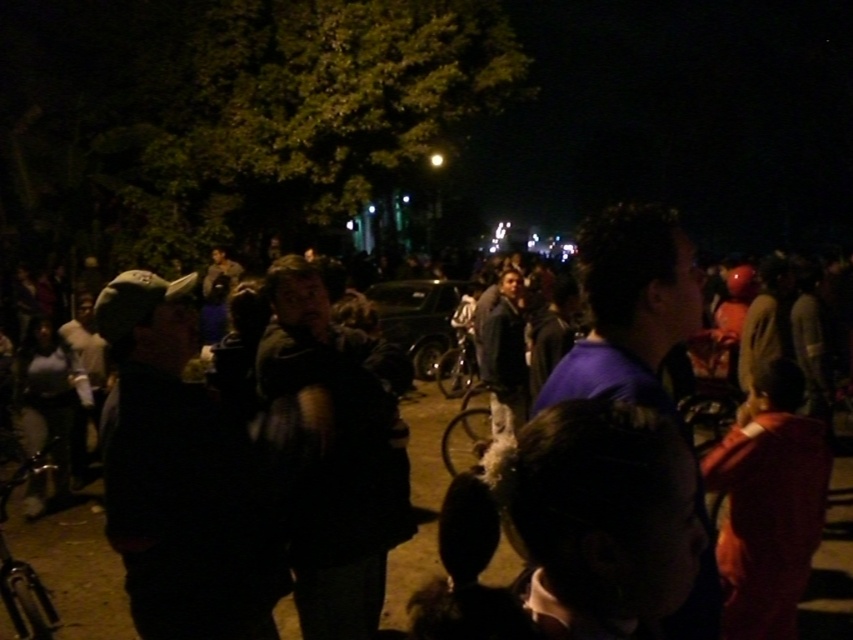
Consider the image. Where is the dark blue jacket at center located in the image?

The dark blue jacket at center is located at point 0.889 on the x axis and 0.090 on the y axis.

You are a photographer trying to capture a photo of the dark blue jacket at center and the shiny metallic bicycle at lower left in this nighttime scene. Which object should you focus on first if you want to ensure both are in sharp focus?

The dark blue jacket at center is shorter than the shiny metallic bicycle at lower left, so you should focus on the shiny metallic bicycle at lower left first to ensure both are in sharp focus.